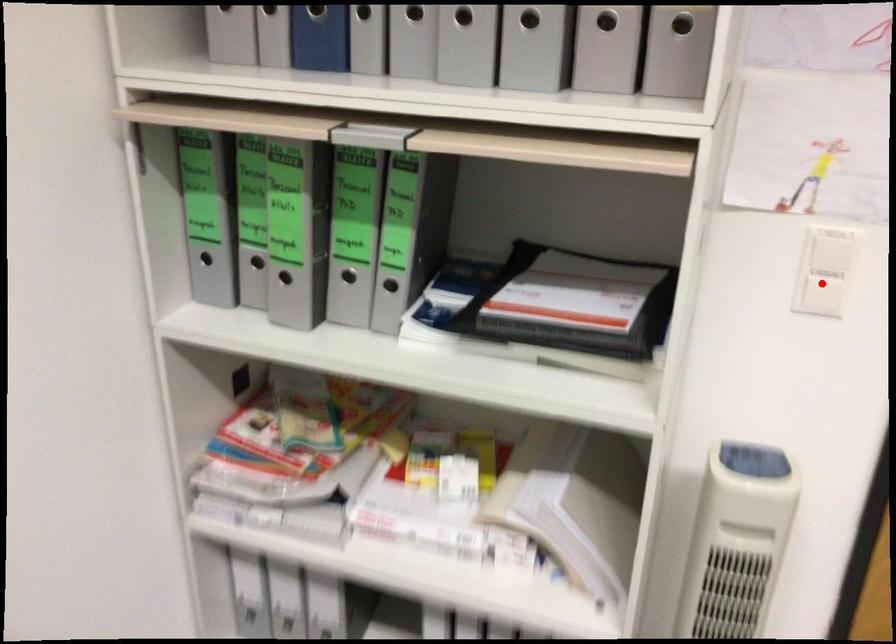
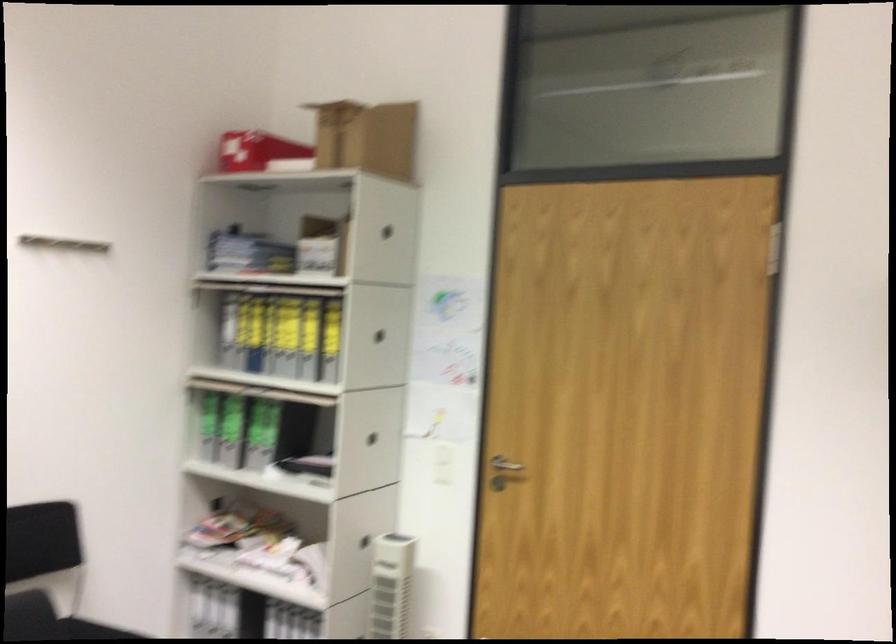
Question: I am providing you with two images of the same scene from different viewpoints. Given a red point in image1, look at the same physical point in image2. Is it:

Choices:
 (A) Closer to the viewpoint
 (B) Farther from the viewpoint

Answer: (B)